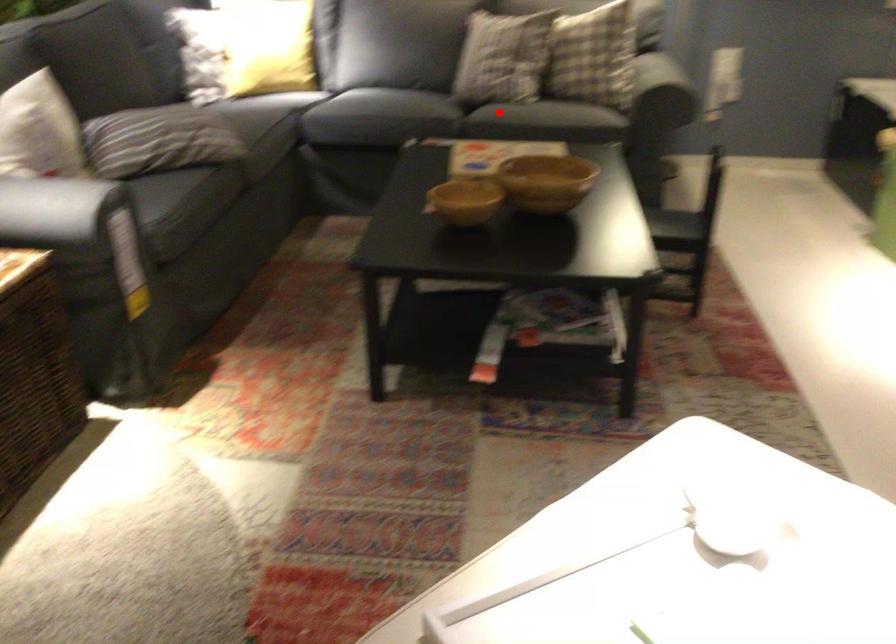
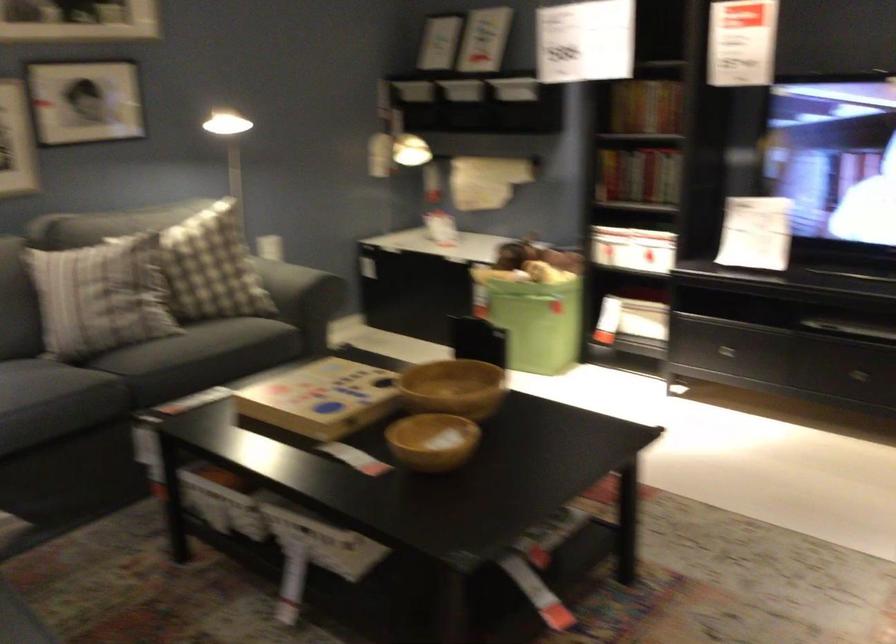
Question: A red point is marked in image1. In image2, is the corresponding 3D point closer to the camera or farther? Reply with the corresponding letter.

Choices:
 (A) The corresponding 3D point is closer.
 (B) The corresponding 3D point is farther.

Answer: (A)